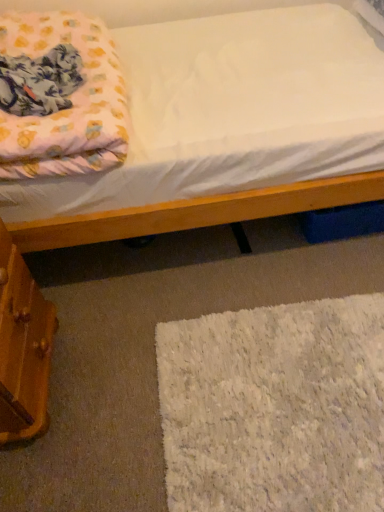
Question: Does white fluffy rug at lower right have a lesser width compared to fluffy pink blanket at upper left?

Choices:
 (A) yes
 (B) no

Answer: (B)

Question: Is white fluffy rug at lower right outside fluffy pink blanket at upper left?

Choices:
 (A) no
 (B) yes

Answer: (B)

Question: Is white fluffy rug at lower right further to the viewer compared to fluffy pink blanket at upper left?

Choices:
 (A) no
 (B) yes

Answer: (B)

Question: Does white fluffy rug at lower right have a greater height compared to fluffy pink blanket at upper left?

Choices:
 (A) yes
 (B) no

Answer: (B)

Question: Is white fluffy rug at lower right not near fluffy pink blanket at upper left?

Choices:
 (A) no
 (B) yes

Answer: (A)

Question: From the image's perspective, relative to wooden drawer at lower left, is white fluffy rug at lower right above or below?

Choices:
 (A) above
 (B) below

Answer: (B)

Question: From a real-world perspective, is white fluffy rug at lower right above or below wooden drawer at lower left?

Choices:
 (A) below
 (B) above

Answer: (A)

Question: In terms of height, does white fluffy rug at lower right look taller or shorter compared to wooden drawer at lower left?

Choices:
 (A) tall
 (B) short

Answer: (B)

Question: Which is correct: white fluffy rug at lower right is inside wooden drawer at lower left, or outside of it?

Choices:
 (A) inside
 (B) outside

Answer: (B)

Question: Based on their positions, is white fluffy rug at lower right located to the left or right of fluffy pink blanket at upper left?

Choices:
 (A) right
 (B) left

Answer: (A)

Question: In the image, is white fluffy rug at lower right positioned in front of or behind fluffy pink blanket at upper left?

Choices:
 (A) behind
 (B) front

Answer: (A)

Question: Based on their sizes in the image, would you say white fluffy rug at lower right is bigger or smaller than fluffy pink blanket at upper left?

Choices:
 (A) small
 (B) big

Answer: (A)

Question: Is white fluffy rug at lower right inside or outside of fluffy pink blanket at upper left?

Choices:
 (A) inside
 (B) outside

Answer: (B)

Question: Which is correct: fluffy pink blanket at upper left is inside white fluffy rug at lower right, or outside of it?

Choices:
 (A) outside
 (B) inside

Answer: (A)

Question: Based on their positions, is fluffy pink blanket at upper left located to the left or right of white fluffy rug at lower right?

Choices:
 (A) right
 (B) left

Answer: (B)